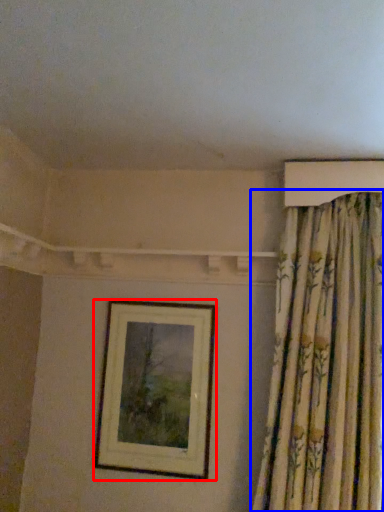
Question: Which point is closer to the camera, picture frame (highlighted by a red box) or curtain (highlighted by a blue box)?

Choices:
 (A) picture frame
 (B) curtain

Answer: (B)